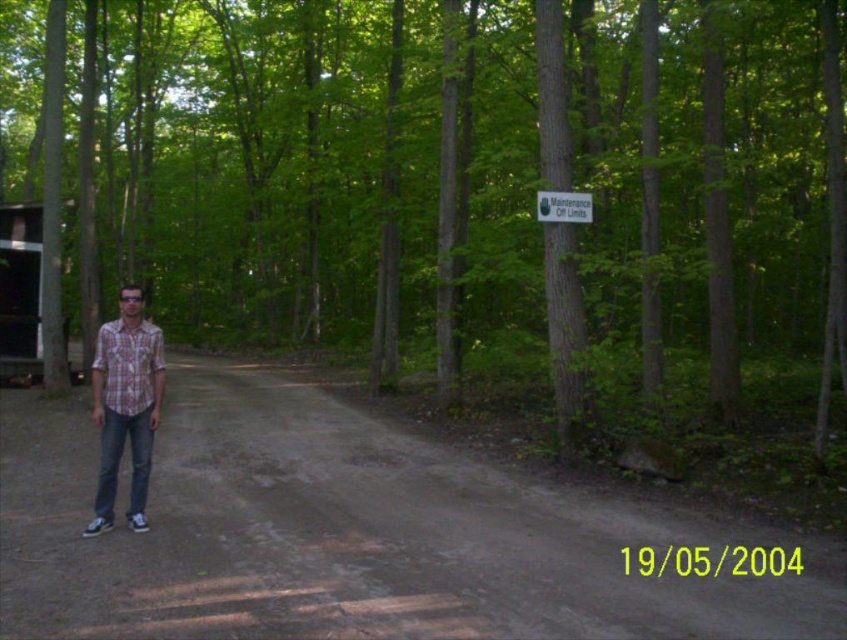
Question: Among these objects, which one is nearest to the camera?

Choices:
 (A) white plastic sign at upper center
 (B) plaid shirt at center
 (C) plaid cotton shirt at center
 (D) brown textured tree at center

Answer: (B)

Question: Among these objects, which one is farthest from the camera?

Choices:
 (A) brown dirt track at center
 (B) plaid shirt at center
 (C) white plastic sign at upper center

Answer: (C)

Question: Observing the image, what is the correct spatial positioning of brown textured tree at center in reference to plaid shirt at center?

Choices:
 (A) right
 (B) left

Answer: (B)

Question: Does brown textured tree at center come behind white plastic sign at upper center?

Choices:
 (A) no
 (B) yes

Answer: (A)

Question: Observing the image, what is the correct spatial positioning of brown textured tree at center in reference to plaid cotton shirt at center?

Choices:
 (A) right
 (B) left

Answer: (B)

Question: Considering the real-world distances, which object is farthest from the brown dirt track at center?

Choices:
 (A) plaid cotton shirt at center
 (B) plaid shirt at center
 (C) brown textured tree at center
 (D) white plastic sign at upper center

Answer: (C)